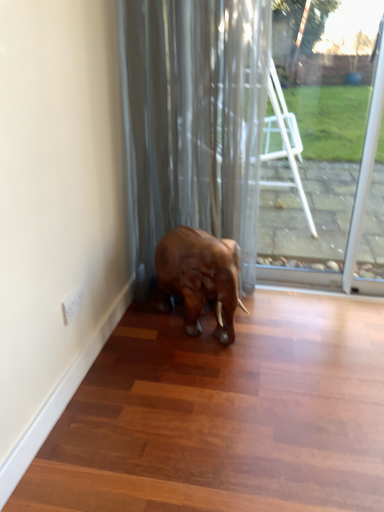
Question: Is transparent glass door at center at the right side of satin gray curtain at center?

Choices:
 (A) yes
 (B) no

Answer: (A)

Question: Is transparent glass door at center completely or partially outside of satin gray curtain at center?

Choices:
 (A) yes
 (B) no

Answer: (A)

Question: Is transparent glass door at center thinner than satin gray curtain at center?

Choices:
 (A) yes
 (B) no

Answer: (A)

Question: Does transparent glass door at center have a smaller size compared to satin gray curtain at center?

Choices:
 (A) no
 (B) yes

Answer: (B)

Question: Is the position of transparent glass door at center less distant than that of satin gray curtain at center?

Choices:
 (A) no
 (B) yes

Answer: (A)

Question: Considering the relative sizes of transparent glass door at center and satin gray curtain at center in the image provided, is transparent glass door at center taller than satin gray curtain at center?

Choices:
 (A) yes
 (B) no

Answer: (B)

Question: Is there a large distance between satin gray curtain at center and shiny brown elephant at center?

Choices:
 (A) no
 (B) yes

Answer: (A)

Question: Considering the relative sizes of satin gray curtain at center and shiny brown elephant at center in the image provided, is satin gray curtain at center smaller than shiny brown elephant at center?

Choices:
 (A) yes
 (B) no

Answer: (B)

Question: Is satin gray curtain at center next to shiny brown elephant at center?

Choices:
 (A) no
 (B) yes

Answer: (A)

Question: From a real-world perspective, is satin gray curtain at center on shiny brown elephant at center?

Choices:
 (A) no
 (B) yes

Answer: (B)

Question: Is satin gray curtain at center looking in the opposite direction of shiny brown elephant at center?

Choices:
 (A) no
 (B) yes

Answer: (B)

Question: Can you confirm if satin gray curtain at center is bigger than shiny brown elephant at center?

Choices:
 (A) yes
 (B) no

Answer: (A)

Question: Considering the relative positions of satin gray curtain at center and transparent glass door at center in the image provided, is satin gray curtain at center to the right of transparent glass door at center from the viewer's perspective?

Choices:
 (A) no
 (B) yes

Answer: (A)